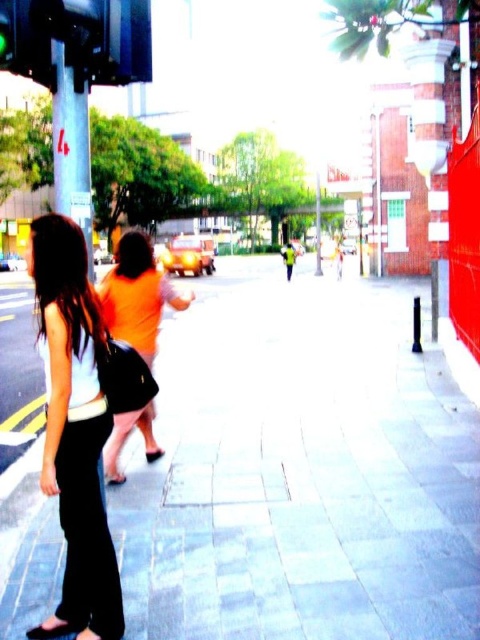
Question: Considering the relative positions of matte black pants at left and orange fabric shirt at center in the image provided, where is matte black pants at left located with respect to orange fabric shirt at center?

Choices:
 (A) right
 (B) left

Answer: (A)

Question: Estimate the real-world distances between objects in this image. Which object is farther from the gray concrete pavement at center?

Choices:
 (A) matte black pants at left
 (B) orange fabric shirt at center

Answer: (A)

Question: Which point appears closest to the camera in this image?

Choices:
 (A) (72, 576)
 (B) (354, 440)
 (C) (145, 236)

Answer: (A)

Question: Is gray concrete pavement at center bigger than orange fabric shirt at center?

Choices:
 (A) yes
 (B) no

Answer: (A)

Question: Is the position of matte black pants at left less distant than that of orange fabric shirt at center?

Choices:
 (A) no
 (B) yes

Answer: (B)

Question: Which point is farther to the camera?

Choices:
 (A) (139, 300)
 (B) (90, 618)

Answer: (A)